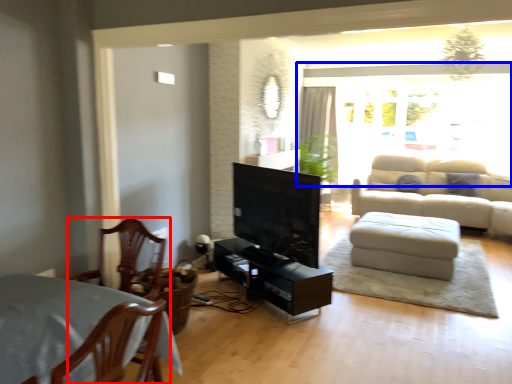
Question: Which object is closer to the camera taking this photo, chair (highlighted by a red box) or window (highlighted by a blue box)?

Choices:
 (A) chair
 (B) window

Answer: (A)